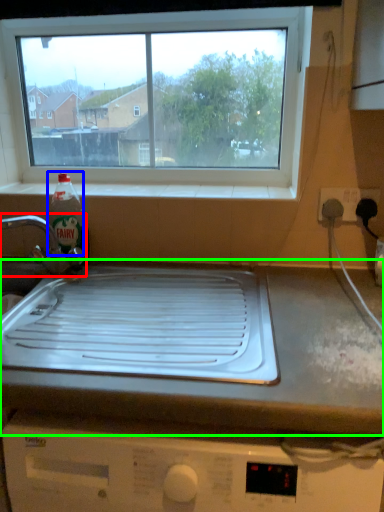
Question: Estimate the real-world distances between objects in this image. Which object is farther from tap (highlighted by a red box), bottle (highlighted by a blue box) or countertop (highlighted by a green box)?

Choices:
 (A) bottle
 (B) countertop

Answer: (B)